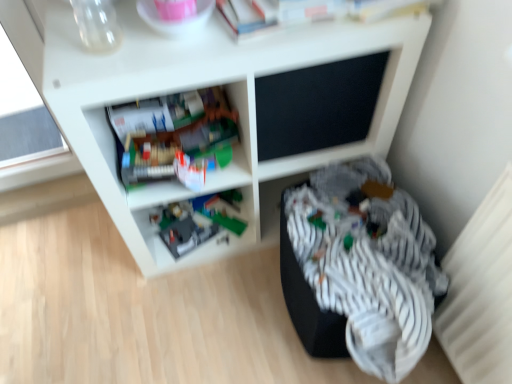
The width and height of the screenshot is (512, 384). I want to click on vacant space in front of white matte shelf at center, which appears as the second shelf when viewed from the back, so [x=211, y=322].